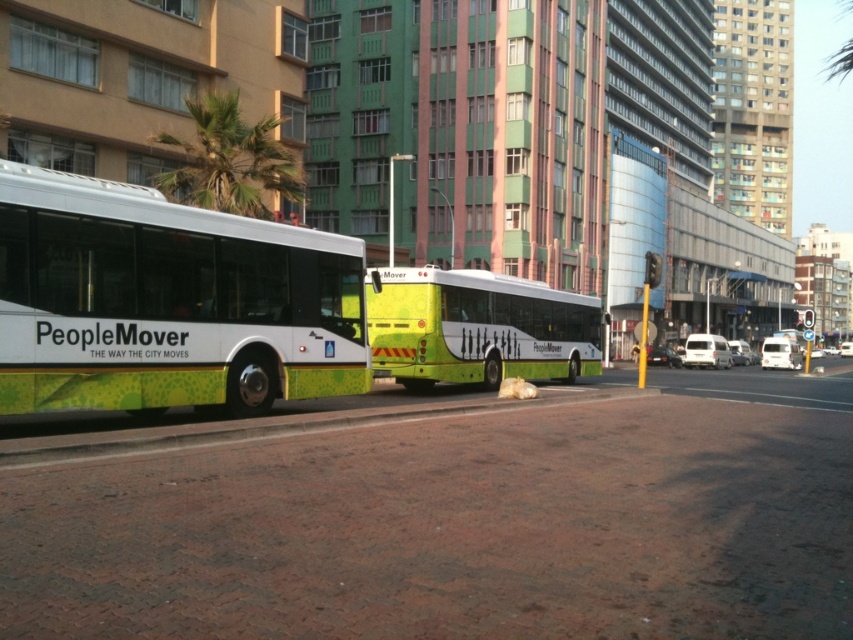
You are a pedestrian standing at the bus stop. You see the white glossy peoplemover bus at left and the green matte bus at center. Which bus is nearer to you?

The white glossy peoplemover bus at left is closer to the viewer than the green matte bus at center, so the white glossy peoplemover bus at left is nearer to you.

You are standing at the bus stop and want to determine which of the two points, point (45,227) or point (463,269), is closer to you. Based on the scene, which point is nearer?

Point (45,227) is closer to the viewer than point (463,269).

You are standing on the sidewalk and want to take a photo of the bus labeled PeopleMover. You notice two points marked on the bus at coordinates point (x=524, y=356) and point (x=625, y=310). Which point will appear closer to the front of the bus in your photo?

Point (x=524, y=356) is closer to the viewer than point (x=625, y=310), so it will appear closer to the front of the bus in the photo.